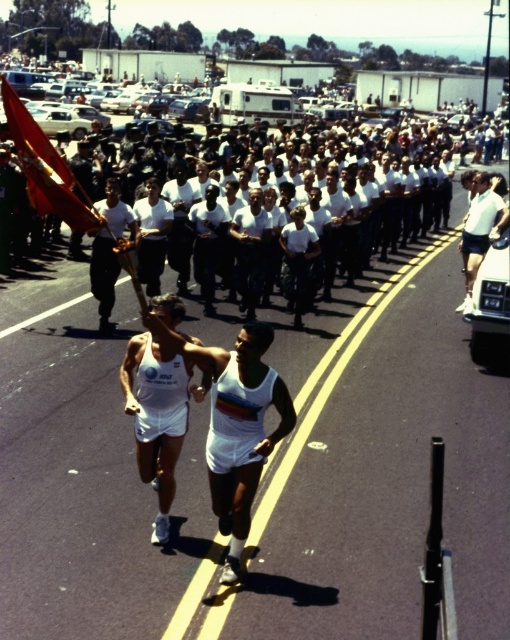
Between red fabric flag at upper left and white matte shorts at center, which one is positioned lower?

white matte shorts at center is lower down.

Does point (64, 195) come behind point (489, 204)?

No, it is in front of (489, 204).

Image resolution: width=510 pixels, height=640 pixels. I want to click on red fabric flag at upper left, so click(x=45, y=168).

Who is taller, red fabric flag at upper left or white uniform at center?

red fabric flag at upper left

Does point (65, 216) come behind point (98, 305)?

No, it is not.

You are a GUI agent. You are given a task and a screenshot of the screen. Output one action in this format:
    pyautogui.click(x=<x>, y=<y>)
    Task: Click on the red fabric flag at upper left
    
    Given the screenshot: What is the action you would take?
    pyautogui.click(x=45, y=168)

Does white fabric tank top at center have a lesser width compared to white uniform at center?

No.

Does point (178, 396) lie in front of point (110, 276)?

Yes, it is.

Where is `white fabric tank top at center`? white fabric tank top at center is located at coordinates (159, 416).